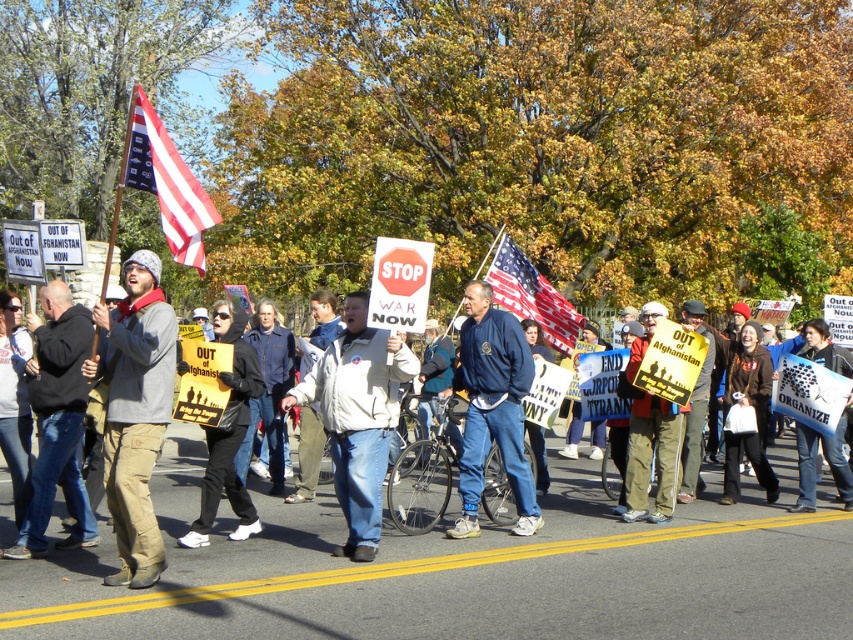
Is gray cotton jacket at center smaller than matte yellow sign at center?

Incorrect, gray cotton jacket at center is not smaller in size than matte yellow sign at center.

Is gray cotton jacket at center taller than matte yellow sign at center?

Correct, gray cotton jacket at center is much taller as matte yellow sign at center.

The width and height of the screenshot is (853, 640). Identify the location of gray cotton jacket at center. (135, 412).

Is black jacket at left shorter than black fabric sign at center?

No, black jacket at left is not shorter than black fabric sign at center.

Is point (67, 406) behind point (233, 422)?

No, (67, 406) is closer to viewer.

The width and height of the screenshot is (853, 640). What are the coordinates of `black jacket at left` in the screenshot? It's located at (57, 420).

Is gray cotton jacket at center thinner than black fabric sign at center?

Incorrect, gray cotton jacket at center's width is not less than black fabric sign at center's.

Based on the photo, is the position of gray cotton jacket at center more distant than that of black fabric sign at center?

No.

Which is behind, point (120, 477) or point (241, 524)?

The point (241, 524) is more distant.

I want to click on gray cotton jacket at center, so click(x=135, y=412).